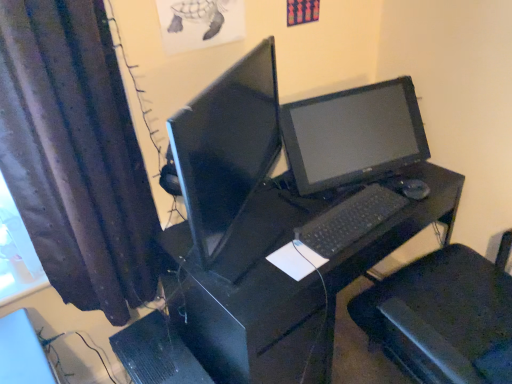
Locate an element on the screen. The width and height of the screenshot is (512, 384). unoccupied space behind white paper at center is located at coordinates (289, 223).